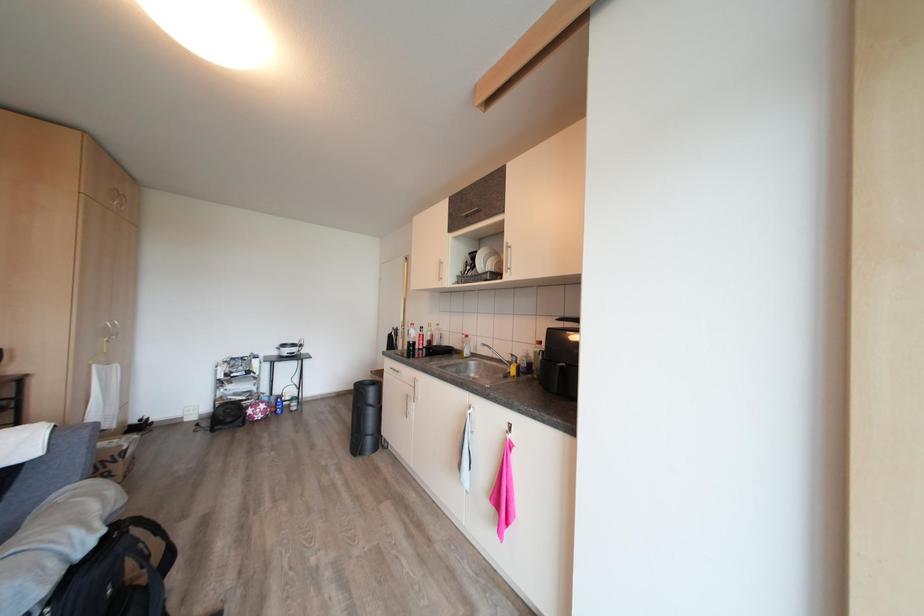
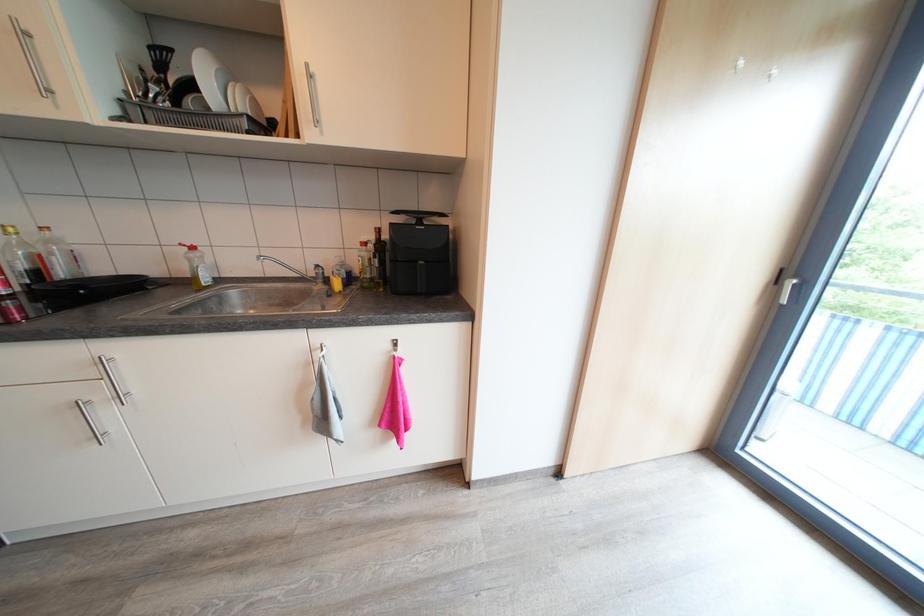
The first image is from the beginning of the video and the second image is from the end. How did the camera likely rotate when shooting the video?

The rotation direction of the camera is right-down.